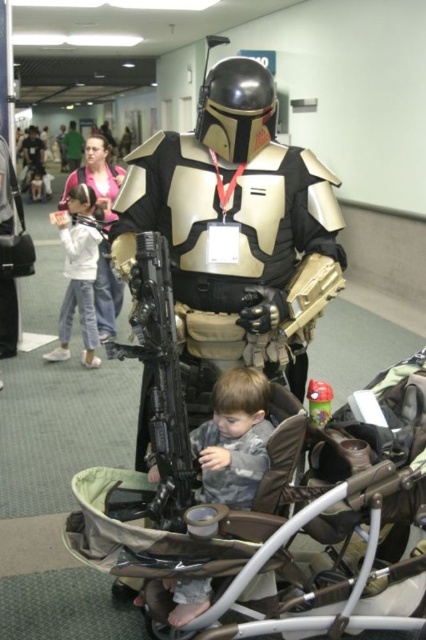
You are a photographer at the convention center. You need to capture a photo where both the gray soft fabric toddler at center and the green fabric shirt at center are visible. Based on their positions, which one should you focus on first to ensure both are in frame?

The gray soft fabric toddler at center is located below the green fabric shirt at center, so you should focus on the green fabric shirt at center first to ensure both are in frame.

You are a photographer at the convention center. You need to position the metallic gold armor at center and the gray soft fabric toddler at center so that the toddler is visible in the frame without being blocked. Based on their current positions, which object should be moved to the left to achieve this?

→ The metallic gold armor at center should be moved to the left since it is currently to the right of the gray soft fabric toddler at center, blocking the toddler from view. Moving the armor to the left would allow the toddler to be visible in the frame.